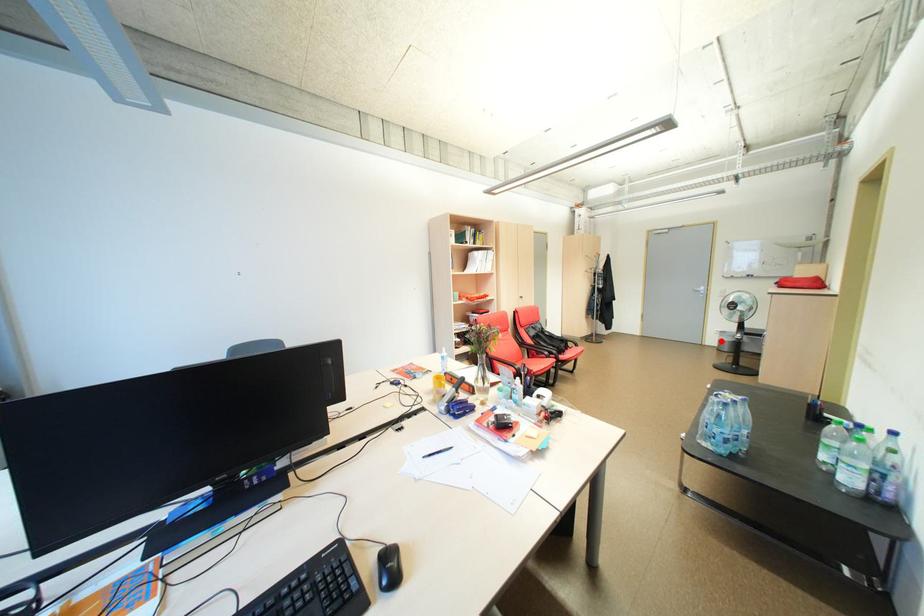
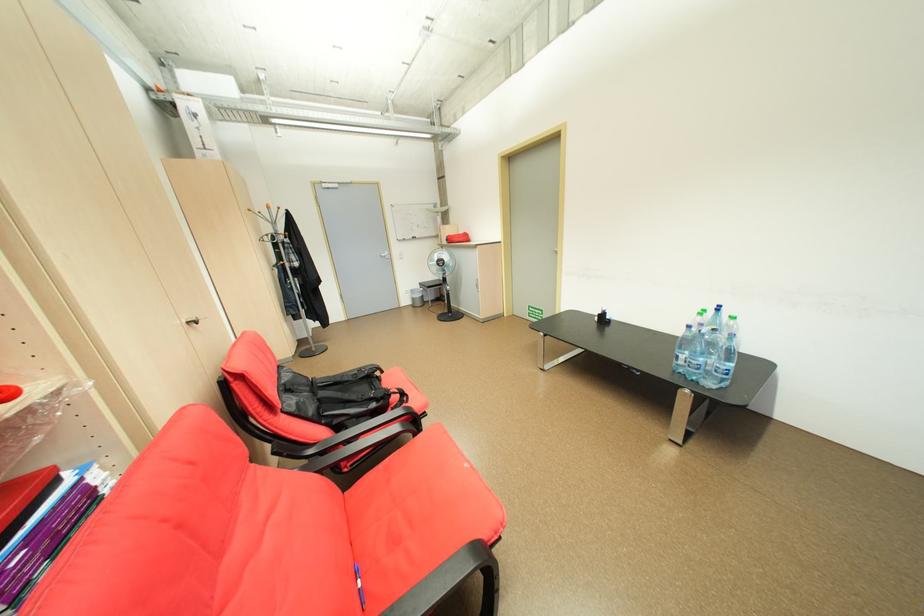
Find the pixel in the second image that matches the highlighted location in the first image.

(415, 302)